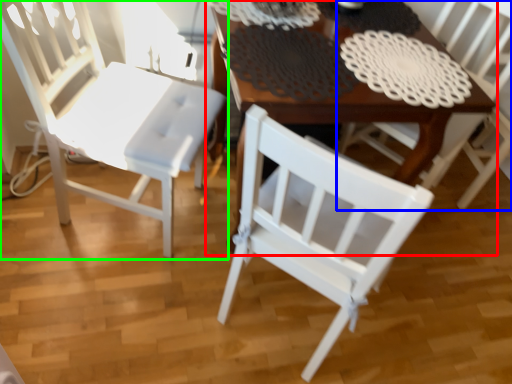
Question: Estimate the real-world distances between objects in this image. Which object is farther from table (highlighted by a red box), chair (highlighted by a blue box) or chair (highlighted by a green box)?

Choices:
 (A) chair
 (B) chair

Answer: (A)